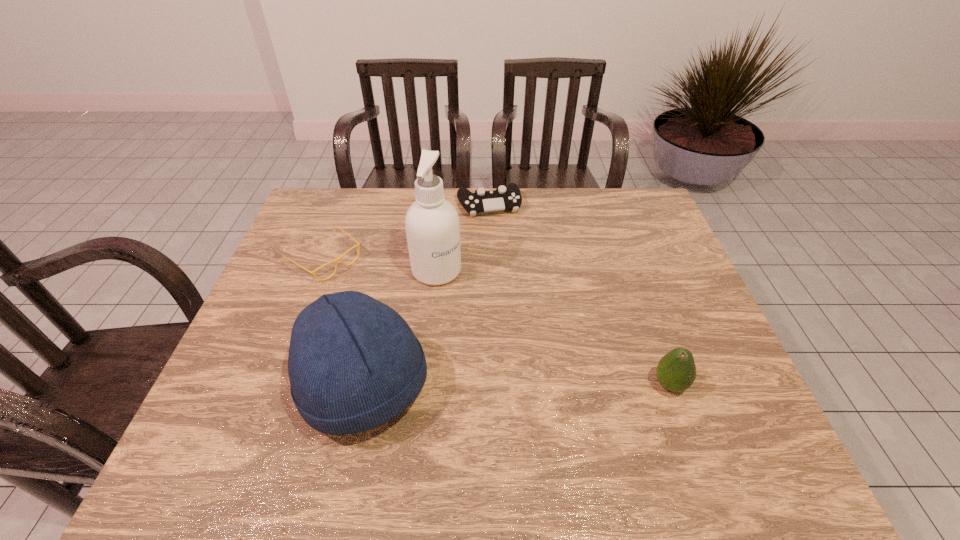
The width and height of the screenshot is (960, 540). In order to click on avocado that is at the near edge in this screenshot , I will do `click(676, 371)`.

This screenshot has width=960, height=540. In order to click on object located at the left edge in this screenshot , I will do `click(338, 259)`.

Find the location of a particular element. The image size is (960, 540). object positioned at the right edge is located at coordinates (676, 371).

Locate an element on the screen. The width and height of the screenshot is (960, 540). object that is at the near right corner is located at coordinates (676, 371).

In the image, there is a desktop. In order to click on vacant region at the far edge in this screenshot , I will do `click(546, 210)`.

Where is `vacant point at the near edge`? The width and height of the screenshot is (960, 540). vacant point at the near edge is located at coordinates (516, 418).

Find the location of a particular element. free space at the left edge of the desktop is located at coordinates (290, 239).

In the image, there is a desktop. At what (x,y) coordinates should I click in order to perform the action: click on vacant space at the right edge. Please return your answer as a coordinate pair (x, y). Looking at the image, I should click on (678, 305).

The height and width of the screenshot is (540, 960). In the image, there is a desktop. What are the coordinates of `free space at the far right corner` in the screenshot? It's located at (608, 188).

At what (x,y) coordinates should I click in order to perform the action: click on vacant space in between the avocado and the shortest object. Please return your answer as a coordinate pair (x, y). The image size is (960, 540). Looking at the image, I should click on (497, 322).